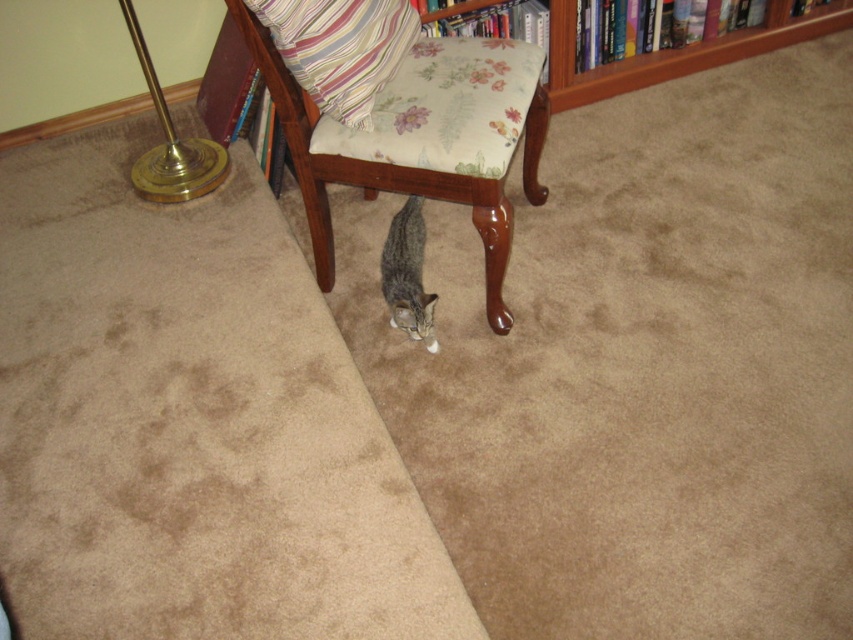
You are standing in the room and want to place a small decorative item exactly at the point marked as point (171, 144). What object is located at that point?

The point (171, 144) corresponds to the brass metallic floor lamp at left.